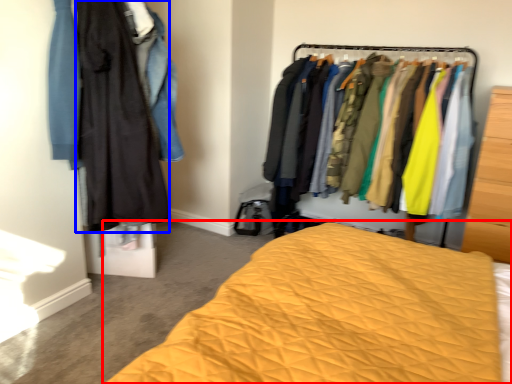
Question: Among these objects, which one is farthest to the camera, bed (highlighted by a red box) or clothing (highlighted by a blue box)?

Choices:
 (A) bed
 (B) clothing

Answer: (B)